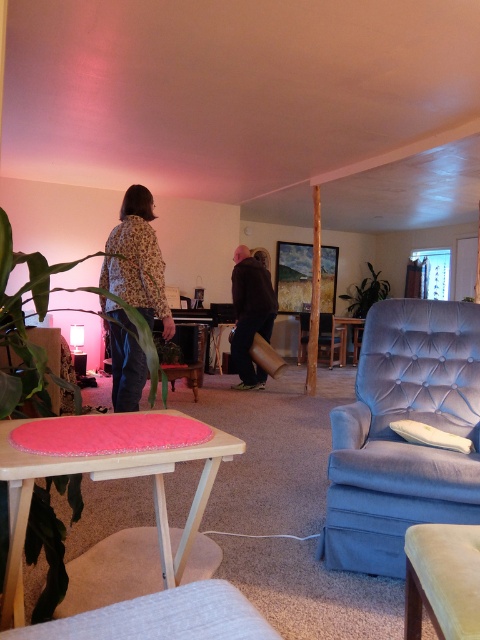
Who is positioned more to the left, pink felt table at lower left or green plastic stool at center?

green plastic stool at center

Between point (26, 483) and point (193, 369), which one is positioned in front?

Point (26, 483) is more forward.

The width and height of the screenshot is (480, 640). I want to click on pink felt table at lower left, so click(x=120, y=531).

Which is more to the left, brown leather jacket at center or green plastic stool at center?

From the viewer's perspective, green plastic stool at center appears more on the left side.

Does point (233, 292) come in front of point (191, 387)?

No, it is not.

Locate an element on the screen. The width and height of the screenshot is (480, 640). brown leather jacket at center is located at coordinates (251, 314).

Can you confirm if velvet blue armchair at right is taller than floral-patterned shirt at left?

No.

Is velvet blue armchair at right in front of floral-patterned shirt at left?

Yes, velvet blue armchair at right is in front of floral-patterned shirt at left.

Between point (467, 436) and point (142, 305), which one is positioned behind?

The point (142, 305) is behind.

Find the location of `velvet blue armchair at right`. velvet blue armchair at right is located at coordinates (402, 436).